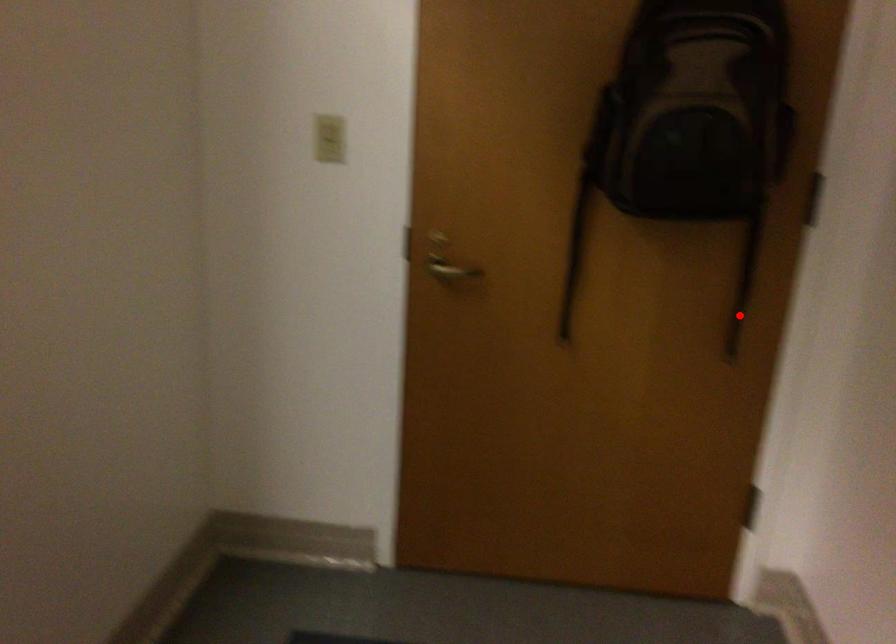
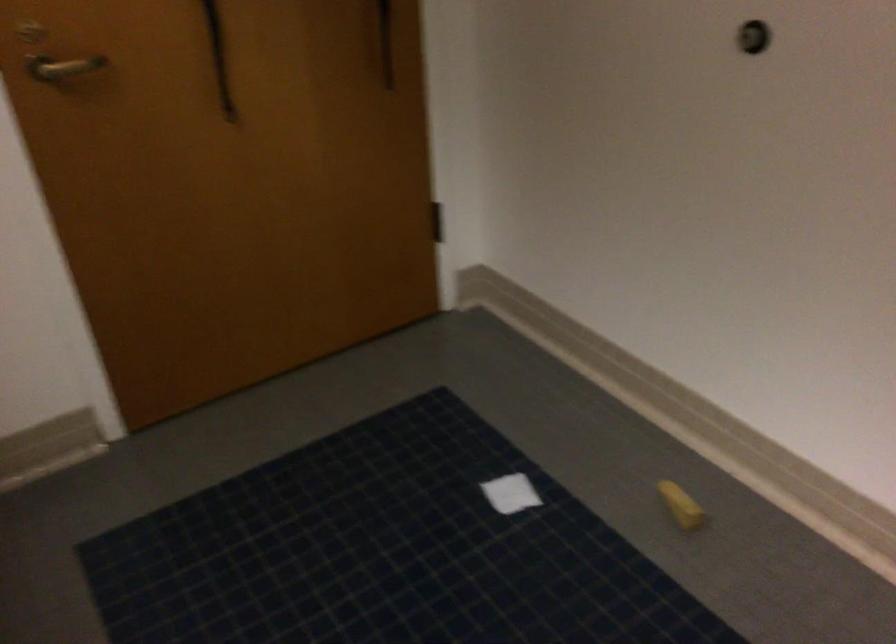
Where in the second image is the point corresponding to the highlighted location from the first image?

(384, 42)